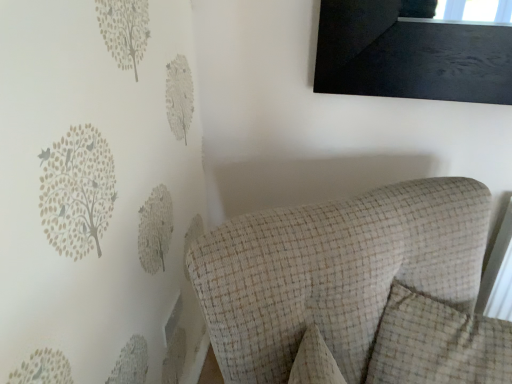
Question: In the image, is textured beige armchair at center positioned in front of or behind beige checkered pillow at center?

Choices:
 (A) front
 (B) behind

Answer: (A)

Question: Choose the correct answer: Is textured beige armchair at center inside beige checkered pillow at center or outside it?

Choices:
 (A) outside
 (B) inside

Answer: (A)

Question: From the image's perspective, is textured beige armchair at center located above or below beige checkered pillow at center?

Choices:
 (A) above
 (B) below

Answer: (B)

Question: In the image, is beige checkered pillow at center on the left side or the right side of textured beige armchair at center?

Choices:
 (A) left
 (B) right

Answer: (B)

Question: Considering the positions of beige checkered pillow at center and textured beige armchair at center in the image, is beige checkered pillow at center taller or shorter than textured beige armchair at center?

Choices:
 (A) short
 (B) tall

Answer: (A)

Question: Is beige checkered pillow at center spatially inside textured beige armchair at center, or outside of it?

Choices:
 (A) inside
 (B) outside

Answer: (A)

Question: Is beige checkered pillow at center wider or thinner than textured beige armchair at center?

Choices:
 (A) wide
 (B) thin

Answer: (B)